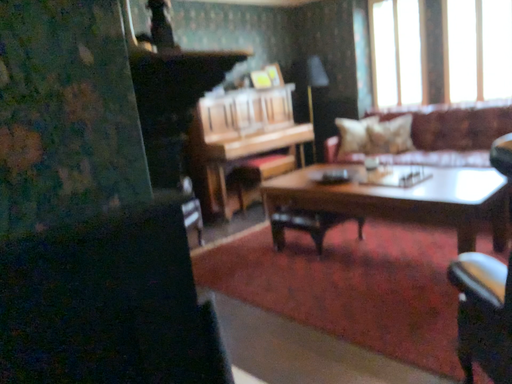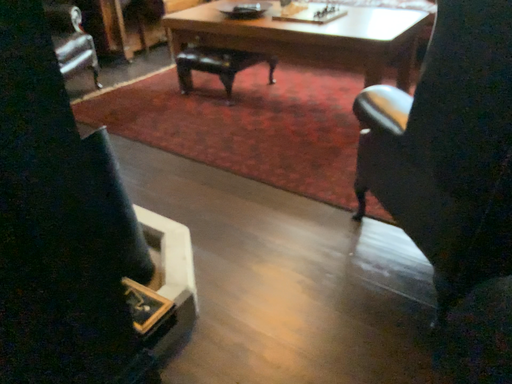
Question: How did the camera likely rotate when shooting the video?

Choices:
 (A) rotated upward
 (B) rotated downward

Answer: (B)